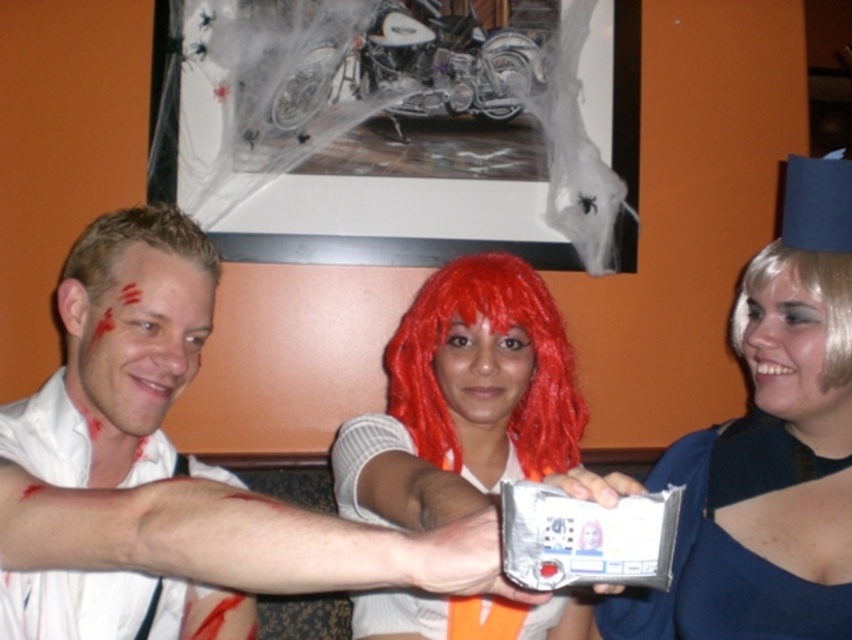
Who is positioned more to the right, blue fabric hat at upper right or blue matte dress at lower right?

Positioned to the right is blue fabric hat at upper right.

Can you confirm if blue fabric hat at upper right is positioned to the left of blue matte dress at lower right?

In fact, blue fabric hat at upper right is to the right of blue matte dress at lower right.

Is point (806, 276) in front of point (677, 621)?

Yes, point (806, 276) is in front of point (677, 621).

Identify the location of blue fabric hat at upper right. The width and height of the screenshot is (852, 640). (769, 449).

From the picture: Which of these two, shiny red wig at center or blonde synthetic wig at right, stands shorter?

With less height is blonde synthetic wig at right.

Which of these two, shiny red wig at center or blonde synthetic wig at right, stands taller?

With more height is shiny red wig at center.

The width and height of the screenshot is (852, 640). Identify the location of shiny red wig at center. (463, 397).

How far apart are white matte shirt at center and blonde hair at left?

A distance of 6.80 inches exists between white matte shirt at center and blonde hair at left.

Who is more forward, (x=164, y=220) or (x=93, y=252)?

Point (x=93, y=252)

You are a GUI agent. You are given a task and a screenshot of the screen. Output one action in this format:
    pyautogui.click(x=<x>, y=<y>)
    Task: Click on the white matte shirt at center
    Image resolution: width=852 pixels, height=640 pixels.
    Given the screenshot: What is the action you would take?
    pyautogui.click(x=167, y=474)